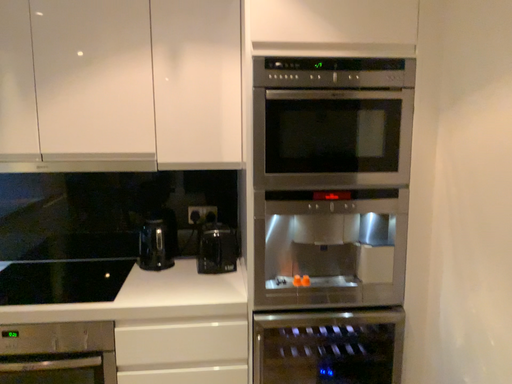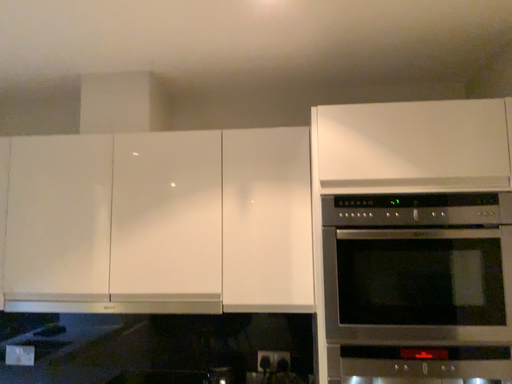
Question: How did the camera likely rotate when shooting the video?

Choices:
 (A) rotated upward
 (B) rotated downward

Answer: (A)